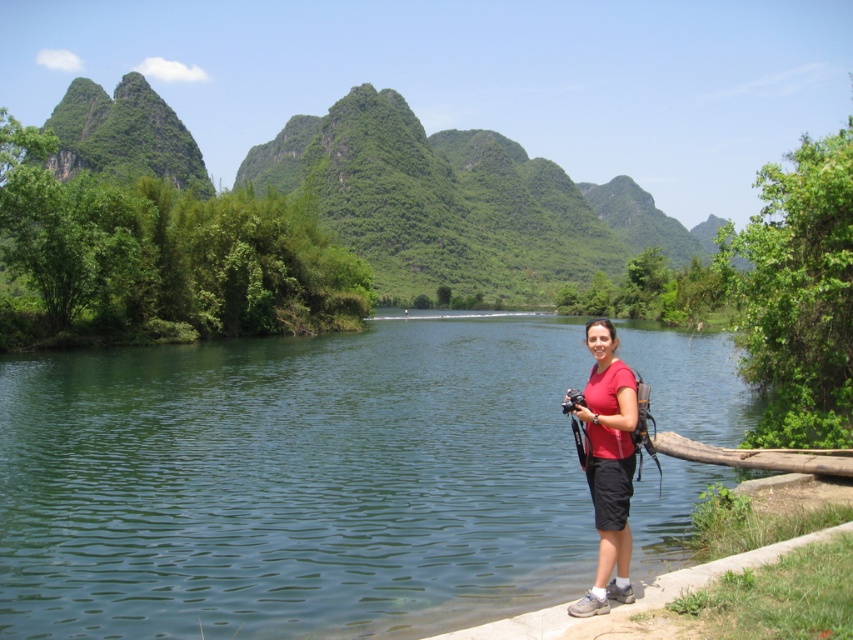
Does green smooth water at center have a lesser width compared to red matte shirt at lower right?

Incorrect, green smooth water at center's width is not less than red matte shirt at lower right's.

Consider the image. Is green smooth water at center in front of red matte shirt at lower right?

No.

Who is more forward, (511, 605) or (572, 609)?

Point (572, 609) is more forward.

This screenshot has height=640, width=853. Identify the location of green smooth water at center. (294, 483).